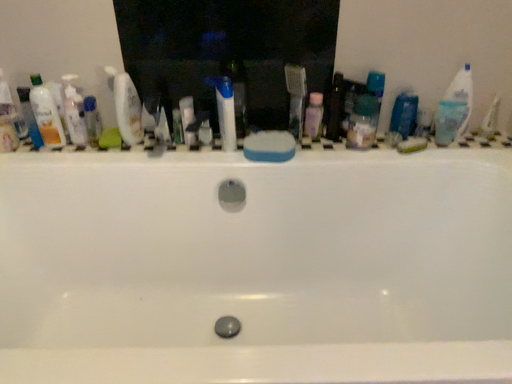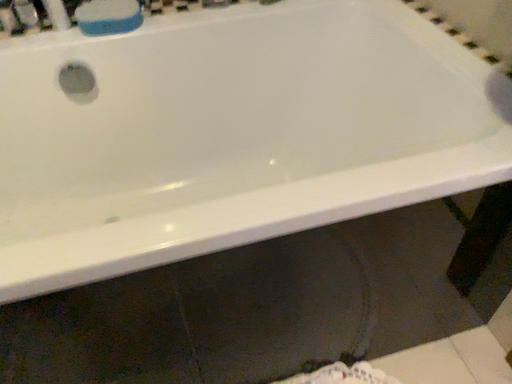
Question: How did the camera likely rotate when shooting the video?

Choices:
 (A) rotated downward
 (B) rotated upward

Answer: (A)